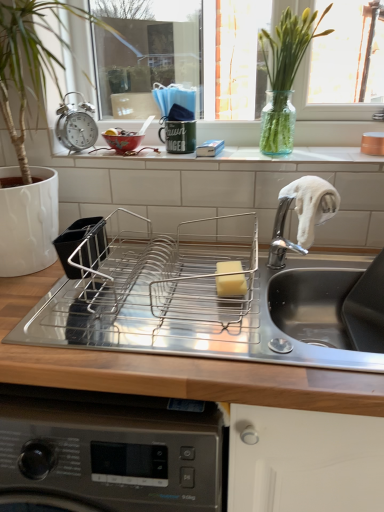
What is the approximate height of metallic alarm clock at upper left?

The height of metallic alarm clock at upper left is 5.04 inches.

I want to click on green glass vase at upper center, so click(x=285, y=76).

The image size is (384, 512). What do you see at coordinates (231, 285) in the screenshot?
I see `yellow sponge at center` at bounding box center [231, 285].

What are the coordinates of `metallic alarm clock at upper left` in the screenshot? It's located at (76, 125).

Is metallic alarm clock at upper left far from white ceramic window sill at center?

That's not correct — metallic alarm clock at upper left is a little close to white ceramic window sill at center.

From a real-world perspective, which is physically below, metallic alarm clock at upper left or white ceramic window sill at center?

In real-world perspective, white ceramic window sill at center is lower.

Which object is closer to the camera, metallic alarm clock at upper left or white ceramic window sill at center?

white ceramic window sill at center is more forward.

Is metallic alarm clock at upper left positioned with its back to white ceramic window sill at center?

metallic alarm clock at upper left does not have its back to white ceramic window sill at center.

Does point (67, 231) lie behind point (66, 113)?

No, (67, 231) is in front of (66, 113).

Considering the sizes of stainless steel dish rack at center and metallic alarm clock at upper left in the image, is stainless steel dish rack at center taller or shorter than metallic alarm clock at upper left?

Considering their sizes, stainless steel dish rack at center has more height than metallic alarm clock at upper left.

From a real-world perspective, is white ceramic window sill at center positioned above or below stainless steel dish rack at center?

From a real-world perspective, white ceramic window sill at center is physically above stainless steel dish rack at center.

Which object is wider, white ceramic window sill at center or stainless steel dish rack at center?

stainless steel dish rack at center.

Is white ceramic window sill at center at the right side of stainless steel dish rack at center?

Yes.

Is white ceramic window sill at center positioned with its back to stainless steel dish rack at center?

No, white ceramic window sill at center is not facing the opposite direction of stainless steel dish rack at center.

Who is smaller, metallic alarm clock at upper left or yellow sponge at center?

yellow sponge at center.

Do you think metallic alarm clock at upper left is within yellow sponge at center, or outside of it?

metallic alarm clock at upper left lies outside yellow sponge at center.

Does point (69, 140) lie in front of point (216, 282)?

No, (69, 140) is behind (216, 282).

Is metallic alarm clock at upper left positioned far away from yellow sponge at center?

That's not correct — metallic alarm clock at upper left is a little close to yellow sponge at center.

What's the angular difference between stainless steel sink at center and green glass vase at upper center's facing directions?

There is a 1.21-degree angle between the facing directions of stainless steel sink at center and green glass vase at upper center.

From the image's perspective, which object appears higher, stainless steel sink at center or green glass vase at upper center?

green glass vase at upper center is shown above in the image.

Looking at this image, is green glass vase at upper center at the back of stainless steel sink at center?

No, stainless steel sink at center's orientation is not away from green glass vase at upper center.

What are the coordinates of `plant above the stainless steel sink at center (from a real-world perspective)` in the screenshot? It's located at (285, 76).

In the scene shown: Is stainless steel sink at center in front of or behind stainless steel dish rack at center in the image?

Clearly, stainless steel sink at center is in front of stainless steel dish rack at center.

Is stainless steel dish rack at center surrounded by stainless steel sink at center?

No, stainless steel sink at center does not contain stainless steel dish rack at center.

Is stainless steel sink at center thinner than stainless steel dish rack at center?

Incorrect, the width of stainless steel sink at center is not less than that of stainless steel dish rack at center.

Consider the image. Between stainless steel sink at center and stainless steel dish rack at center, which one has larger size?

With larger size is stainless steel sink at center.

Can you tell me how much stainless steel dish rack at center and stainless steel sink at center differ in facing direction?

0.819 degrees separate the facing orientations of stainless steel dish rack at center and stainless steel sink at center.

In the scene shown: Is stainless steel dish rack at center wider than stainless steel sink at center?

No.

From their relative heights in the image, would you say stainless steel dish rack at center is taller or shorter than stainless steel sink at center?

stainless steel dish rack at center is shorter than stainless steel sink at center.

This screenshot has width=384, height=512. Find the location of `window sill located underneath the metallic alarm clock at upper left (from a real-world perspective)`. window sill located underneath the metallic alarm clock at upper left (from a real-world perspective) is located at coordinates [251, 157].

You are a GUI agent. You are given a task and a screenshot of the screen. Output one action in this format:
    pyautogui.click(x=<x>, y=<y>)
    Task: Click on the appliance that appears below the metallic alarm clock at upper left (from the image's perspective)
    This screenshot has width=384, height=512.
    Given the screenshot: What is the action you would take?
    pyautogui.click(x=163, y=269)

Considering their positions, is stainless steel dish rack at center positioned closer to stainless steel sink at center than metallic alarm clock at upper left?

The object closer to stainless steel sink at center is stainless steel dish rack at center.

From the image, which object appears to be nearer to white ceramic window sill at center, green glass vase at upper center or yellow sponge at center?

The object closer to white ceramic window sill at center is green glass vase at upper center.

Considering their positions, is stainless steel sink at center positioned closer to metallic alarm clock at upper left than green glass vase at upper center?

green glass vase at upper center lies closer to metallic alarm clock at upper left than the other object.

Estimate the real-world distances between objects in this image. Which object is closer to metallic alarm clock at upper left, white ceramic window sill at center or stainless steel sink at center?

white ceramic window sill at center.

In the scene shown: When comparing their distances from yellow sponge at center, does metallic alarm clock at upper left or green glass vase at upper center seem closer?

green glass vase at upper center is positioned closer to the anchor yellow sponge at center.

Which object lies nearer to the anchor point green glass vase at upper center, stainless steel sink at center or white ceramic window sill at center?

white ceramic window sill at center.

Based on their spatial positions, is white ceramic window sill at center or stainless steel sink at center further from stainless steel dish rack at center?

white ceramic window sill at center is positioned further to the anchor stainless steel dish rack at center.

Considering their positions, is metallic alarm clock at upper left positioned further to stainless steel sink at center than yellow sponge at center?

The object further to stainless steel sink at center is metallic alarm clock at upper left.

Locate an element on the screen. The width and height of the screenshot is (384, 512). basin located between metallic alarm clock at upper left and green glass vase at upper center in the left-right direction is located at coordinates (123, 142).

Find the location of a particular element. The width and height of the screenshot is (384, 512). food between metallic alarm clock at upper left and stainless steel sink at center in the up-down direction is located at coordinates (231, 285).

What are the coordinates of `basin between green glass vase at upper center and yellow sponge at center from top to bottom` in the screenshot? It's located at (123, 142).

At what (x,y) coordinates should I click in order to perform the action: click on window sill between matte ceramic bowl at upper left and yellow sponge at center vertically. Please return your answer as a coordinate pair (x, y). Looking at the image, I should click on (251, 157).